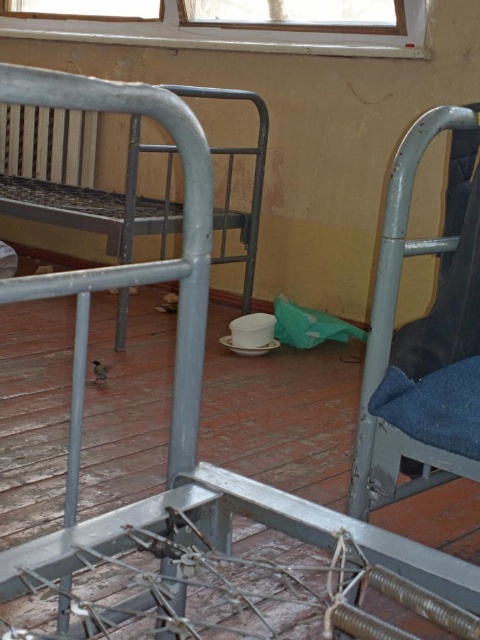
Question: Where is blue fabric chair at right located in relation to wooden frame window at upper center in the image?

Choices:
 (A) above
 (B) below

Answer: (B)

Question: Is blue fabric chair at right closer to the viewer compared to wooden frame window at upper center?

Choices:
 (A) yes
 (B) no

Answer: (A)

Question: Does metallic gray bed at left appear on the left side of blue fabric chair at right?

Choices:
 (A) no
 (B) yes

Answer: (B)

Question: Among these points, which one is farthest from the camera?

Choices:
 (A) (255, 241)
 (B) (386, 29)
 (C) (406, 161)

Answer: (A)

Question: Estimate the real-world distances between objects in this image. Which object is farther from the wooden frame window at upper center?

Choices:
 (A) blue fabric chair at right
 (B) metallic gray bed at left

Answer: (A)

Question: Estimate the real-world distances between objects in this image. Which object is closer to the wooden frame window at upper center?

Choices:
 (A) blue fabric chair at right
 (B) metallic gray bed at left

Answer: (B)